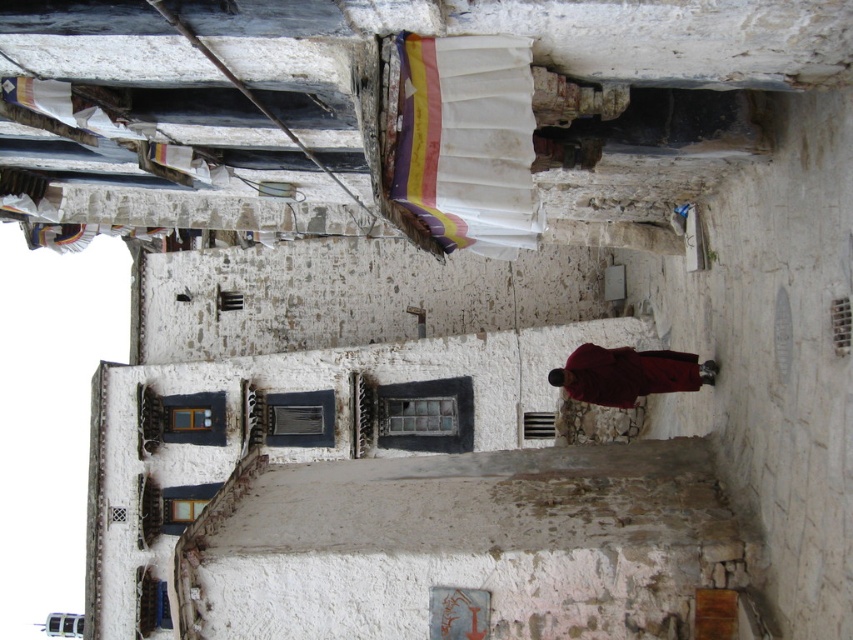
Can you confirm if white fabric at upper center is positioned to the left of maroon woolen robe at center?

Correct, you'll find white fabric at upper center to the left of maroon woolen robe at center.

Is point (445, 106) behind point (595, 387)?

That is False.

The height and width of the screenshot is (640, 853). Find the location of `white fabric at upper center`. white fabric at upper center is located at coordinates [467, 141].